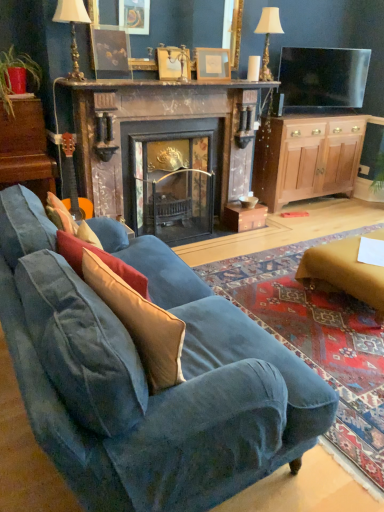
Locate an element on the screen. free space in front of wooden cabinet at right is located at coordinates (314, 219).